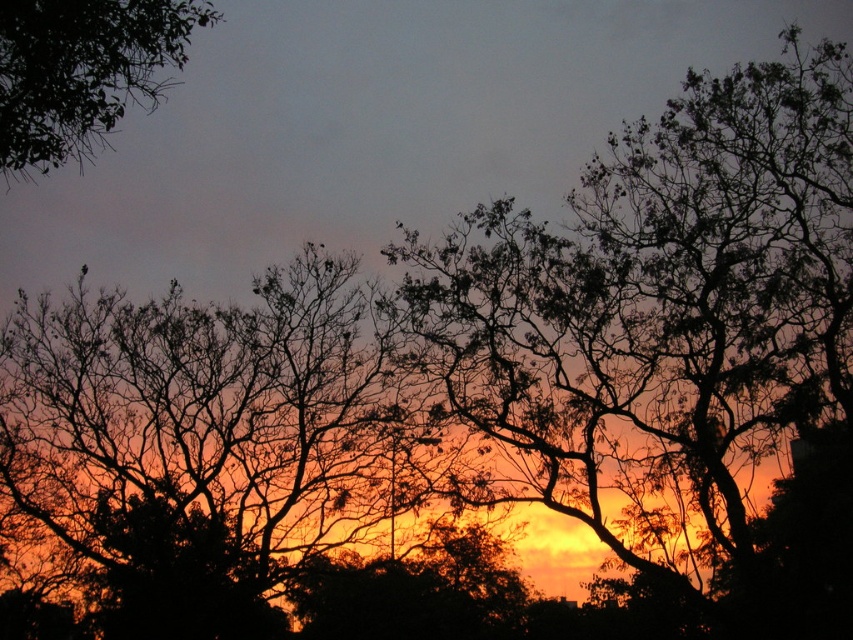
You are an artist trying to paint the sunset scene. You notice two trees in the upper part of the image. Which tree, the silhouette tree at upper right or the green leafy tree at upper left, should you paint first to ensure proper layering based on their heights?

The silhouette tree at upper right is taller than the green leafy tree at upper left. To ensure proper layering, you should paint the shorter green leafy tree at upper left first, then the taller silhouette tree at upper right on top of it.

You are an artist trying to paint the sunset scene. You need to position the silhouette tree at upper right and the green leafy tree at upper left correctly. Based on the scene description, which tree is positioned to the right of the other?

The silhouette tree at upper right is positioned to the right of the green leafy tree at upper left.

You are an artist painting the sunset scene. You want to ensure the silhouette tree at upper right and the green leafy tree at upper left are proportionally accurate. Which tree should you draw larger in your painting?

The silhouette tree at upper right should be drawn larger than the green leafy tree at upper left because it is bigger in the scene.